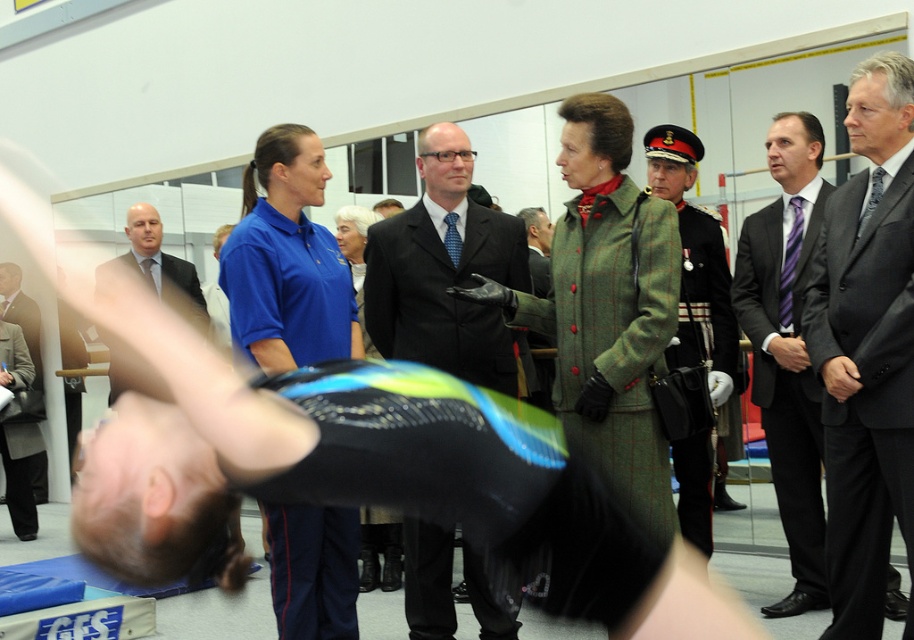
Is black suit at center above purple striped tie at center?

Indeed, black suit at center is positioned over purple striped tie at center.

Based on the photo, does black suit at center have a smaller size compared to purple striped tie at center?

Correct, black suit at center occupies less space than purple striped tie at center.

Who is more distant from viewer, (470, 269) or (785, 524)?

The point (785, 524) is behind.

Identify the location of black suit at center. (444, 269).

Can you confirm if dark gray suit at center is wider than black suit at center?

In fact, dark gray suit at center might be narrower than black suit at center.

Which is below, dark gray suit at center or black suit at center?

dark gray suit at center is below.

Locate an element on the screen. This screenshot has height=640, width=914. dark gray suit at center is located at coordinates (867, 349).

Is point (831, 564) farther from camera compared to point (769, 276)?

That is False.

Is point (891, 444) in front of point (806, 166)?

Yes, point (891, 444) is in front of point (806, 166).

This screenshot has height=640, width=914. I want to click on dark gray suit at center, so click(867, 349).

What are the coordinates of `dark gray suit at center` in the screenshot? It's located at (867, 349).